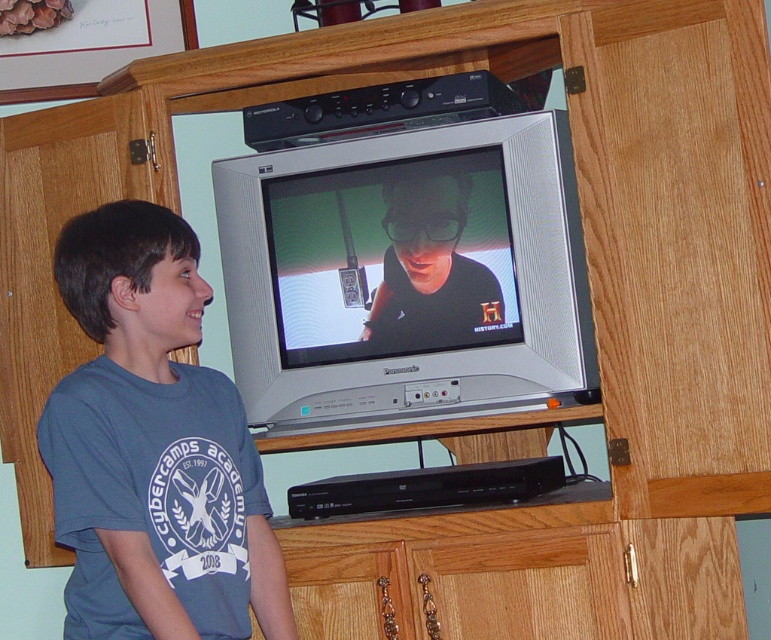
How distant is silver metallic television at center from blue cotton shirt at center?

silver metallic television at center and blue cotton shirt at center are 15.12 inches apart from each other.

Can you confirm if silver metallic television at center is shorter than blue cotton shirt at center?

Yes.

Is point (588, 339) positioned behind point (217, 419)?

Yes, point (588, 339) is farther from viewer.

Where is `silver metallic television at center`? silver metallic television at center is located at coordinates (406, 275).